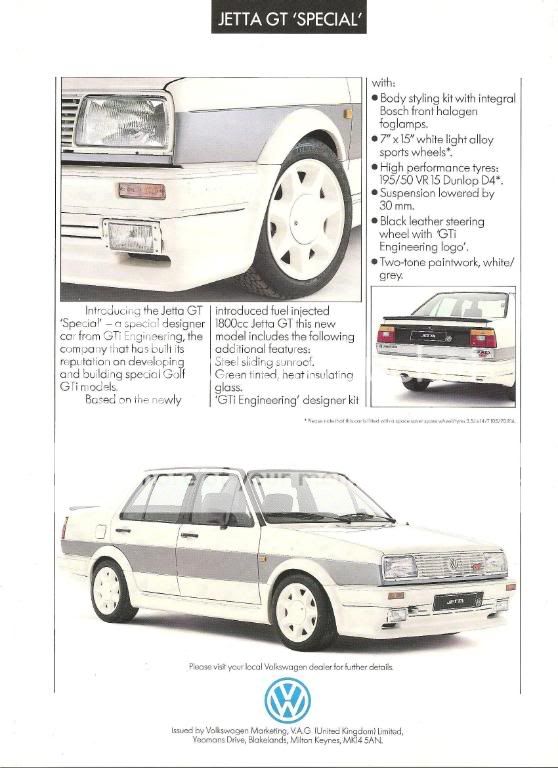
Find the location of `the back window`. the back window is located at coordinates (465, 303).